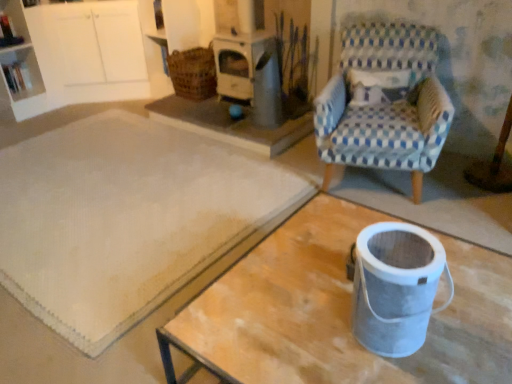
Question: From a real-world perspective, is metallic gray bucket at lower right beneath white plastic shelf at upper left?

Choices:
 (A) yes
 (B) no

Answer: (B)

Question: Is metallic gray bucket at lower right to the right of white plastic shelf at upper left from the viewer's perspective?

Choices:
 (A) yes
 (B) no

Answer: (A)

Question: From the image's perspective, would you say metallic gray bucket at lower right is positioned over white plastic shelf at upper left?

Choices:
 (A) no
 (B) yes

Answer: (A)

Question: Considering the relative sizes of metallic gray bucket at lower right and white plastic shelf at upper left in the image provided, is metallic gray bucket at lower right bigger than white plastic shelf at upper left?

Choices:
 (A) no
 (B) yes

Answer: (B)

Question: Is metallic gray bucket at lower right oriented away from white plastic shelf at upper left?

Choices:
 (A) yes
 (B) no

Answer: (B)

Question: Does metallic gray bucket at lower right have a greater width compared to white plastic shelf at upper left?

Choices:
 (A) yes
 (B) no

Answer: (A)

Question: Is white textured rug at center oriented away from woven brown basket at upper center?

Choices:
 (A) yes
 (B) no

Answer: (B)

Question: Does white textured rug at center have a larger size compared to woven brown basket at upper center?

Choices:
 (A) yes
 (B) no

Answer: (A)

Question: Is white textured rug at center shorter than woven brown basket at upper center?

Choices:
 (A) yes
 (B) no

Answer: (A)

Question: Considering the relative sizes of white textured rug at center and woven brown basket at upper center in the image provided, is white textured rug at center wider than woven brown basket at upper center?

Choices:
 (A) yes
 (B) no

Answer: (A)

Question: Is woven brown basket at upper center inside white textured rug at center?

Choices:
 (A) no
 (B) yes

Answer: (A)

Question: From the image's perspective, is white textured rug at center beneath woven brown basket at upper center?

Choices:
 (A) yes
 (B) no

Answer: (A)

Question: From the image's perspective, is white plastic shelf at upper left located beneath white textured rug at center?

Choices:
 (A) no
 (B) yes

Answer: (A)